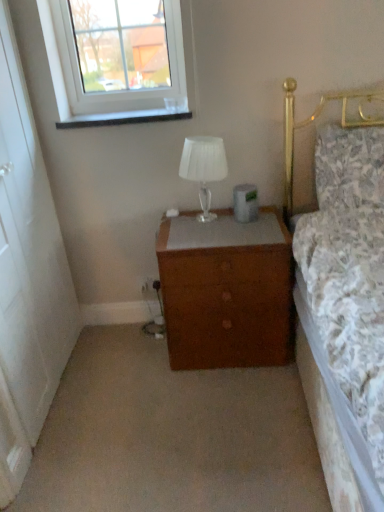
Where is `free location to the left of brown wooden chest of drawers at center`? free location to the left of brown wooden chest of drawers at center is located at coordinates (123, 361).